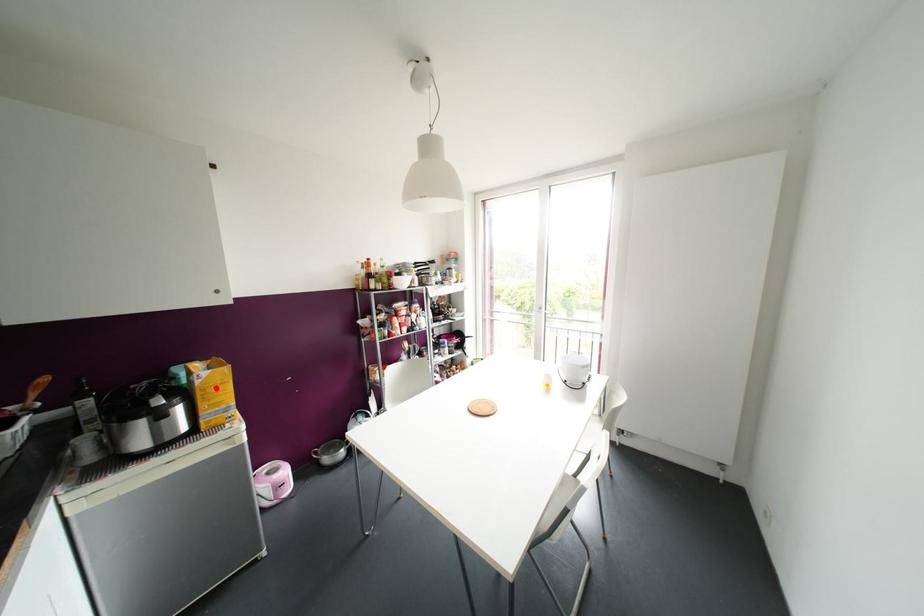
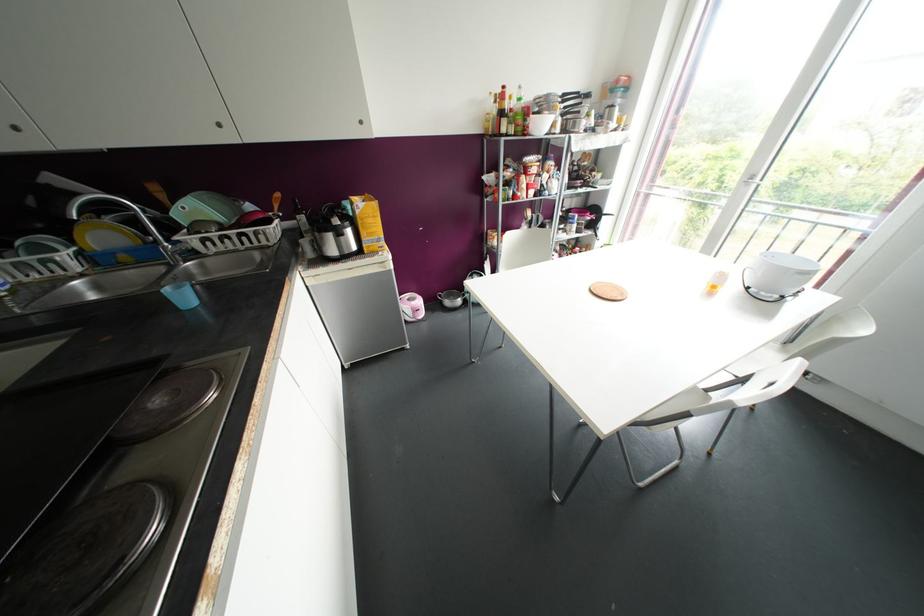
Question: A red point is marked in image1. In image2, is the corresponding 3D point closer to the camera or farther? Reply with the corresponding letter.

Choices:
 (A) The corresponding 3D point is closer.
 (B) The corresponding 3D point is farther.

Answer: (A)